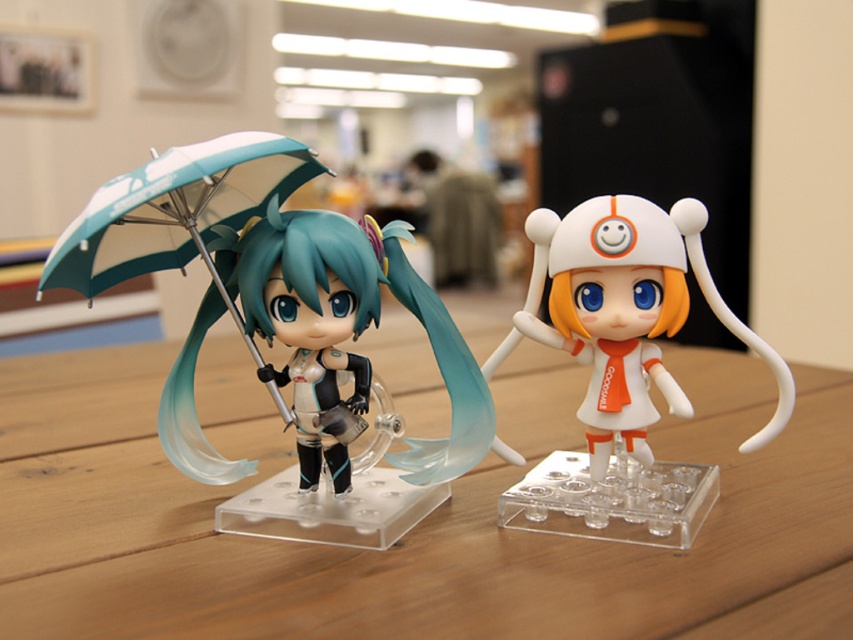
At what (x,y) coordinates should I click in order to perform the action: click on teal matte umbrella at left. Please return your answer as a coordinate pair (x, y). Looking at the image, I should click on (177, 211).

Can you confirm if teal matte umbrella at left is bigger than matte black figure at left?

Yes.

The width and height of the screenshot is (853, 640). Describe the element at coordinates (177, 211) in the screenshot. I see `teal matte umbrella at left` at that location.

Identify the location of teal matte umbrella at left. (177, 211).

Is wooden table at center to the left of matte black figure at left from the viewer's perspective?

Yes, wooden table at center is to the left of matte black figure at left.

Based on the photo, is wooden table at center further to camera compared to matte black figure at left?

No.

Is point (166, 493) closer to camera compared to point (386, 262)?

No, (166, 493) is further to viewer.

The height and width of the screenshot is (640, 853). I want to click on wooden table at center, so click(x=410, y=531).

Is wooden table at center shorter than white matte plush toy at right?

Correct, wooden table at center is not as tall as white matte plush toy at right.

Does wooden table at center appear on the right side of white matte plush toy at right?

Incorrect, wooden table at center is not on the right side of white matte plush toy at right.

Does point (827, 628) come behind point (543, 333)?

No.

Locate an element on the screen. The height and width of the screenshot is (640, 853). wooden table at center is located at coordinates (410, 531).